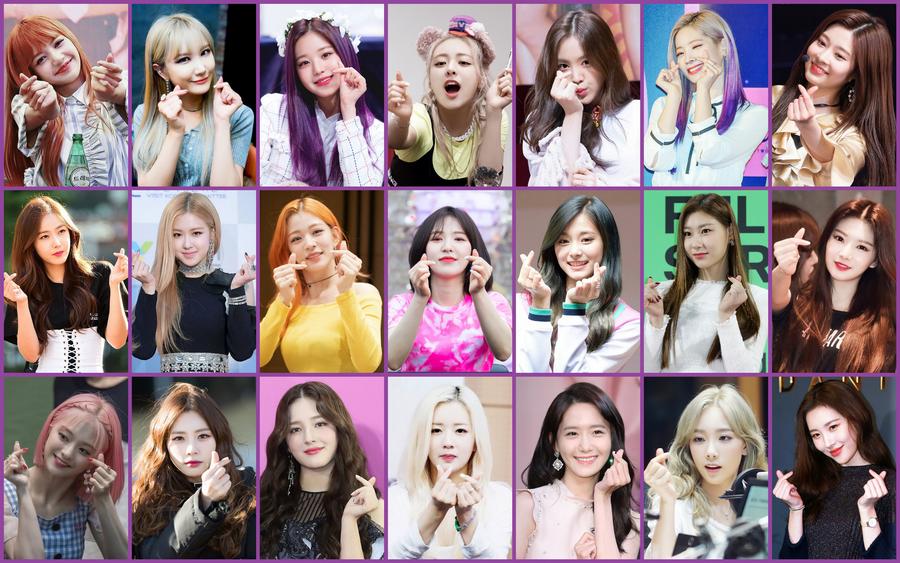
Where is `glass bottle`? The height and width of the screenshot is (563, 900). glass bottle is located at coordinates (73, 175).